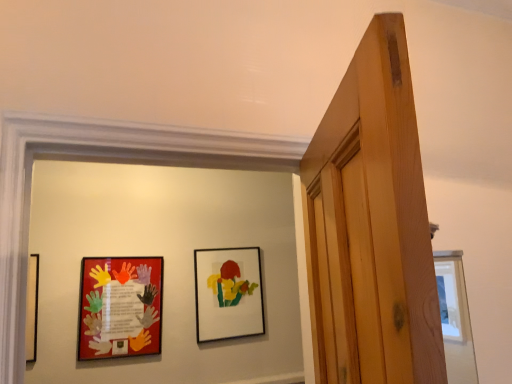
What do you see at coordinates (120, 307) in the screenshot? I see `matte plastic picture frame at left, which ranks as the 2th picture frame in back-to-front order` at bounding box center [120, 307].

Locate an element on the screen. The width and height of the screenshot is (512, 384). matte plastic picture frame at left, the first picture frame in the front-to-back sequence is located at coordinates (120, 307).

How much space does matte black picture frame at center, arranged as the first picture frame when viewed from the right, occupy horizontally?

matte black picture frame at center, arranged as the first picture frame when viewed from the right, is 1.54 inches wide.

Where is `matte black picture frame at center, placed as the 2th picture frame when sorted from left to right`? Image resolution: width=512 pixels, height=384 pixels. matte black picture frame at center, placed as the 2th picture frame when sorted from left to right is located at coordinates (228, 293).

The width and height of the screenshot is (512, 384). What do you see at coordinates (228, 293) in the screenshot? I see `matte black picture frame at center, marked as the 1th picture frame in a back-to-front arrangement` at bounding box center [228, 293].

In order to click on matte plastic picture frame at left, which is counted as the second picture frame, starting from the right in this screenshot , I will do `click(120, 307)`.

Does matte plastic picture frame at left, which is counted as the second picture frame, starting from the right, appear on the right side of matte black picture frame at center, marked as the 1th picture frame in a back-to-front arrangement?

No, matte plastic picture frame at left, which is counted as the second picture frame, starting from the right, is not to the right of matte black picture frame at center, marked as the 1th picture frame in a back-to-front arrangement.

Between matte plastic picture frame at left, which is counted as the second picture frame, starting from the right, and matte black picture frame at center, arranged as the first picture frame when viewed from the right, which one is positioned behind?

matte black picture frame at center, arranged as the first picture frame when viewed from the right.

Is point (152, 318) positioned before point (197, 249)?

That is True.

From the image's perspective, is matte plastic picture frame at left, the 1th picture frame positioned from the left, above or below matte black picture frame at center, placed as the 2th picture frame when sorted from left to right?

Based on their image positions, matte plastic picture frame at left, the 1th picture frame positioned from the left, is located beneath matte black picture frame at center, placed as the 2th picture frame when sorted from left to right.

From a real-world perspective, which is physically below, matte plastic picture frame at left, which is counted as the second picture frame, starting from the right, or matte black picture frame at center, arranged as the first picture frame when viewed from the right?

matte plastic picture frame at left, which is counted as the second picture frame, starting from the right, is physically lower.

Considering the relative sizes of matte plastic picture frame at left, which ranks as the 2th picture frame in back-to-front order, and matte black picture frame at center, marked as the 1th picture frame in a back-to-front arrangement, in the image provided, is matte plastic picture frame at left, which ranks as the 2th picture frame in back-to-front order, wider than matte black picture frame at center, marked as the 1th picture frame in a back-to-front arrangement,?

In fact, matte plastic picture frame at left, which ranks as the 2th picture frame in back-to-front order, might be narrower than matte black picture frame at center, marked as the 1th picture frame in a back-to-front arrangement.

Is matte plastic picture frame at left, which is counted as the second picture frame, starting from the right, taller or shorter than matte black picture frame at center, placed as the 2th picture frame when sorted from left to right?

matte plastic picture frame at left, which is counted as the second picture frame, starting from the right, is shorter than matte black picture frame at center, placed as the 2th picture frame when sorted from left to right.

Looking at this image, is matte plastic picture frame at left, the 1th picture frame positioned from the left, bigger or smaller than matte black picture frame at center, arranged as the first picture frame when viewed from the right?

Clearly, matte plastic picture frame at left, the 1th picture frame positioned from the left, is smaller in size than matte black picture frame at center, arranged as the first picture frame when viewed from the right.

Is matte plastic picture frame at left, which is counted as the second picture frame, starting from the right, inside or outside of matte black picture frame at center, marked as the 1th picture frame in a back-to-front arrangement?

matte plastic picture frame at left, which is counted as the second picture frame, starting from the right, is not inside matte black picture frame at center, marked as the 1th picture frame in a back-to-front arrangement, it's outside.

Is matte plastic picture frame at left, which ranks as the 2th picture frame in back-to-front order, not close to matte black picture frame at center, placed as the 2th picture frame when sorted from left to right?

matte plastic picture frame at left, which ranks as the 2th picture frame in back-to-front order, is actually quite close to matte black picture frame at center, placed as the 2th picture frame when sorted from left to right.

Is matte plastic picture frame at left, the 1th picture frame positioned from the left, facing away from matte black picture frame at center, the 2th picture frame from the front?

matte plastic picture frame at left, the 1th picture frame positioned from the left, does not have its back to matte black picture frame at center, the 2th picture frame from the front.

Could you measure the distance between matte plastic picture frame at left, the first picture frame in the front-to-back sequence, and matte black picture frame at center, the 2th picture frame from the front?

16.21 inches.

Find the location of a particular element. This screenshot has width=512, height=384. picture frame on the left of matte black picture frame at center, marked as the 1th picture frame in a back-to-front arrangement is located at coordinates (120, 307).

Which object is positioned more to the right, matte black picture frame at center, the 2th picture frame from the front, or matte plastic picture frame at left, the first picture frame in the front-to-back sequence?

Positioned to the right is matte black picture frame at center, the 2th picture frame from the front.

Relative to matte plastic picture frame at left, the first picture frame in the front-to-back sequence, is matte black picture frame at center, placed as the 2th picture frame when sorted from left to right, in front or behind?

In the image, matte black picture frame at center, placed as the 2th picture frame when sorted from left to right, appears behind matte plastic picture frame at left, the first picture frame in the front-to-back sequence.

In the scene shown: Which is more distant, (259,253) or (110,297)?

The point (259,253) is behind.

From the image's perspective, relative to matte plastic picture frame at left, the first picture frame in the front-to-back sequence, is matte black picture frame at center, marked as the 1th picture frame in a back-to-front arrangement, above or below?

matte black picture frame at center, marked as the 1th picture frame in a back-to-front arrangement, is situated higher than matte plastic picture frame at left, the first picture frame in the front-to-back sequence, in the image.

From a real-world perspective, is matte black picture frame at center, marked as the 1th picture frame in a back-to-front arrangement, physically below matte plastic picture frame at left, which ranks as the 2th picture frame in back-to-front order?

Incorrect, from a real-world perspective, matte black picture frame at center, marked as the 1th picture frame in a back-to-front arrangement, is higher than matte plastic picture frame at left, which ranks as the 2th picture frame in back-to-front order.

Looking at their sizes, would you say matte black picture frame at center, arranged as the first picture frame when viewed from the right, is wider or thinner than matte plastic picture frame at left, which ranks as the 2th picture frame in back-to-front order?

Clearly, matte black picture frame at center, arranged as the first picture frame when viewed from the right, has more width compared to matte plastic picture frame at left, which ranks as the 2th picture frame in back-to-front order.

Considering the sizes of objects matte black picture frame at center, arranged as the first picture frame when viewed from the right, and matte plastic picture frame at left, the first picture frame in the front-to-back sequence, in the image provided, who is taller, matte black picture frame at center, arranged as the first picture frame when viewed from the right, or matte plastic picture frame at left, the first picture frame in the front-to-back sequence,?

matte black picture frame at center, arranged as the first picture frame when viewed from the right, is taller.

Who is smaller, matte black picture frame at center, placed as the 2th picture frame when sorted from left to right, or matte plastic picture frame at left, which ranks as the 2th picture frame in back-to-front order?

matte plastic picture frame at left, which ranks as the 2th picture frame in back-to-front order, is smaller.

Do you think matte black picture frame at center, the 2th picture frame from the front, is within matte plastic picture frame at left, the first picture frame in the front-to-back sequence, or outside of it?

matte black picture frame at center, the 2th picture frame from the front, is not inside matte plastic picture frame at left, the first picture frame in the front-to-back sequence, it's outside.

Would you consider matte black picture frame at center, the 2th picture frame from the front, to be distant from matte plastic picture frame at left, which ranks as the 2th picture frame in back-to-front order?

That's not correct — matte black picture frame at center, the 2th picture frame from the front, is a little close to matte plastic picture frame at left, which ranks as the 2th picture frame in back-to-front order.

Is matte black picture frame at center, placed as the 2th picture frame when sorted from left to right, facing towards matte plastic picture frame at left, which is counted as the second picture frame, starting from the right?

No, matte black picture frame at center, placed as the 2th picture frame when sorted from left to right, is not oriented towards matte plastic picture frame at left, which is counted as the second picture frame, starting from the right.

How different are the orientations of matte black picture frame at center, placed as the 2th picture frame when sorted from left to right, and matte plastic picture frame at left, which is counted as the second picture frame, starting from the right, in degrees?

The facing directions of matte black picture frame at center, placed as the 2th picture frame when sorted from left to right, and matte plastic picture frame at left, which is counted as the second picture frame, starting from the right, are 1.05 degrees apart.

At what (x,y) coordinates should I click in order to perform the action: click on picture frame that appears above the matte plastic picture frame at left, the first picture frame in the front-to-back sequence (from the image's perspective). Please return your answer as a coordinate pair (x, y). This screenshot has width=512, height=384. Looking at the image, I should click on (228, 293).

At what (x,y) coordinates should I click in order to perform the action: click on picture frame behind the matte plastic picture frame at left, the 1th picture frame positioned from the left. Please return your answer as a coordinate pair (x, y). The height and width of the screenshot is (384, 512). Looking at the image, I should click on (228, 293).

Identify the location of picture frame that is below the matte black picture frame at center, arranged as the first picture frame when viewed from the right (from the image's perspective). The height and width of the screenshot is (384, 512). (120, 307).